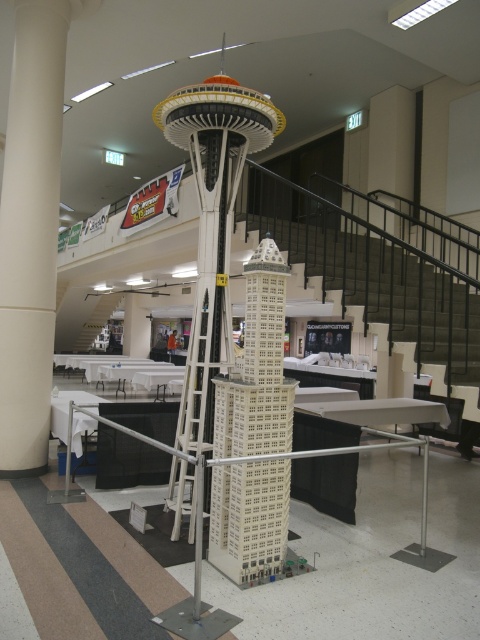
You are an event planner setting up for a tech conference. You need to place a 1.2 meter wide banner between the white smooth pillar at center and the white plastic building at center. Can the space between them accommodate the banner?

The white smooth pillar at center is larger than the white plastic building at center, but the exact distance between them isn

You are an event planner setting up a booth in the convention center. You want to place a promotional banner in front of the white plastic building at center so that it is visible from the entrance. However, there is a white smooth pillar at center blocking the view. Can you position the banner in a way that it is visible while still being in front of the building?

The white plastic building at center is behind the white smooth pillar at center, so placing the banner in front of the building would require positioning it behind the pillar. This would make the banner visible from the entrance only if the pillar is transparent, which it is not. Therefore, the banner cannot be placed to be both in front of the building and visible from the entrance simultaneously.